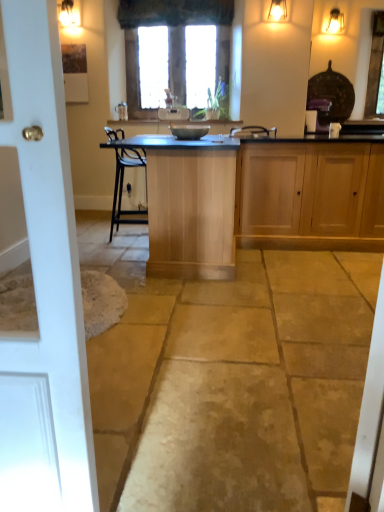
Question: Can you see matte silver faucet at center touching light wood table at center?

Choices:
 (A) no
 (B) yes

Answer: (A)

Question: Is matte silver faucet at center facing away from light wood table at center?

Choices:
 (A) no
 (B) yes

Answer: (A)

Question: Is matte silver faucet at center positioned in front of light wood table at center?

Choices:
 (A) no
 (B) yes

Answer: (A)

Question: Does matte silver faucet at center have a greater width compared to light wood table at center?

Choices:
 (A) no
 (B) yes

Answer: (A)

Question: From the image's perspective, is matte silver faucet at center located above light wood table at center?

Choices:
 (A) yes
 (B) no

Answer: (A)

Question: Can you confirm if matte silver faucet at center is positioned to the right of light wood table at center?

Choices:
 (A) no
 (B) yes

Answer: (A)

Question: Is matte gold light fixture at upper right turned away from matte black appliance at center?

Choices:
 (A) no
 (B) yes

Answer: (A)

Question: Would you say matte gold light fixture at upper right is a long distance from matte black appliance at center?

Choices:
 (A) no
 (B) yes

Answer: (B)

Question: Is matte gold light fixture at upper right in front of matte black appliance at center?

Choices:
 (A) yes
 (B) no

Answer: (B)

Question: Is matte gold light fixture at upper right smaller than matte black appliance at center?

Choices:
 (A) yes
 (B) no

Answer: (A)

Question: From a real-world perspective, is matte gold light fixture at upper right physically below matte black appliance at center?

Choices:
 (A) yes
 (B) no

Answer: (B)

Question: From the image's perspective, is matte gold light fixture at upper right beneath matte black appliance at center?

Choices:
 (A) yes
 (B) no

Answer: (B)

Question: Can you confirm if matte gold light fixture at upper right is positioned to the right of matte silver faucet at center?

Choices:
 (A) no
 (B) yes

Answer: (B)